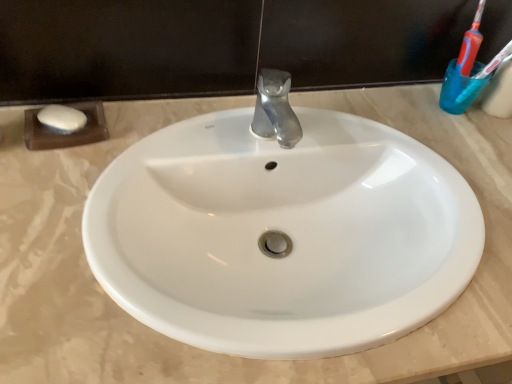
Question: From the image's perspective, is white glossy sink at center above transparent plastic cup at upper right?

Choices:
 (A) no
 (B) yes

Answer: (A)

Question: Are white glossy sink at center and transparent plastic cup at upper right making contact?

Choices:
 (A) yes
 (B) no

Answer: (B)

Question: From the image's perspective, is white glossy sink at center under transparent plastic cup at upper right?

Choices:
 (A) yes
 (B) no

Answer: (A)

Question: Considering the relative sizes of white glossy sink at center and transparent plastic cup at upper right in the image provided, is white glossy sink at center bigger than transparent plastic cup at upper right?

Choices:
 (A) no
 (B) yes

Answer: (B)

Question: Could you tell me if white glossy sink at center is facing transparent plastic cup at upper right?

Choices:
 (A) yes
 (B) no

Answer: (B)

Question: Does white glossy sink at center lie behind transparent plastic cup at upper right?

Choices:
 (A) no
 (B) yes

Answer: (A)

Question: Is translucent plastic toothbrush at upper right located within white glossy sink at center?

Choices:
 (A) yes
 (B) no

Answer: (B)

Question: From a real-world perspective, is white glossy sink at center on top of translucent plastic toothbrush at upper right?

Choices:
 (A) yes
 (B) no

Answer: (B)

Question: Can we say white glossy sink at center lies outside translucent plastic toothbrush at upper right?

Choices:
 (A) no
 (B) yes

Answer: (B)

Question: Would you consider white glossy sink at center to be distant from translucent plastic toothbrush at upper right?

Choices:
 (A) no
 (B) yes

Answer: (A)

Question: Considering the relative sizes of white glossy sink at center and translucent plastic toothbrush at upper right in the image provided, is white glossy sink at center wider than translucent plastic toothbrush at upper right?

Choices:
 (A) no
 (B) yes

Answer: (B)

Question: Is white glossy sink at center facing away from translucent plastic toothbrush at upper right?

Choices:
 (A) yes
 (B) no

Answer: (B)

Question: Does translucent plastic toothbrush at upper right have a lesser width compared to transparent plastic cup at upper right?

Choices:
 (A) yes
 (B) no

Answer: (A)